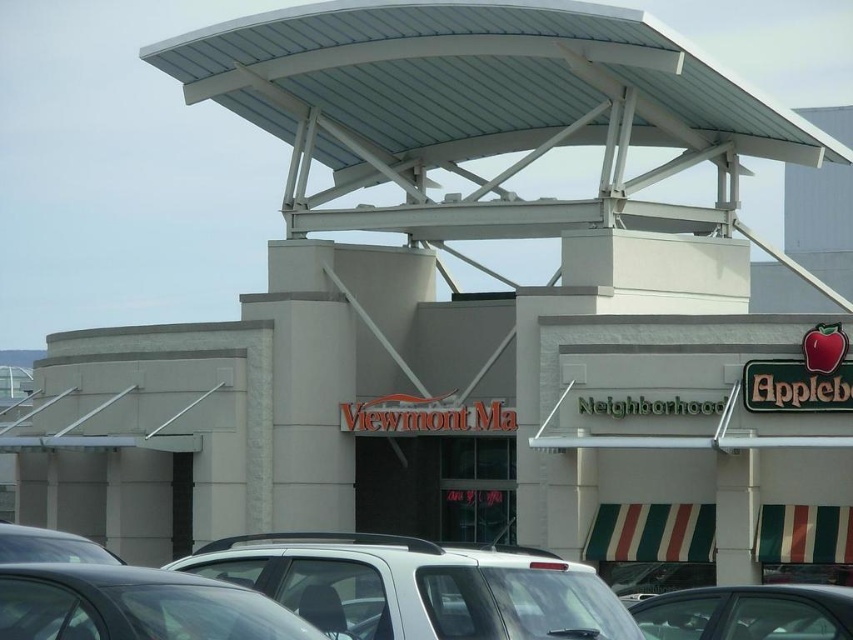
Question: Is white matte suv at center to the left of metallic silver car at center from the viewer's perspective?

Choices:
 (A) no
 (B) yes

Answer: (B)

Question: Based on their relative distances, which object is farther from the white matte suv at center?

Choices:
 (A) shiny black car at lower left
 (B) metallic silver car at center

Answer: (B)

Question: Is shiny black car at lower left to the right of metallic silver car at center from the viewer's perspective?

Choices:
 (A) no
 (B) yes

Answer: (A)

Question: Which of the following is the closest to the observer?

Choices:
 (A) (637, 621)
 (B) (590, 580)

Answer: (B)

Question: Is shiny black car at lower left positioned before metallic silver car at center?

Choices:
 (A) yes
 (B) no

Answer: (A)

Question: Among these points, which one is farthest from the camera?

Choices:
 (A) (347, 625)
 (B) (311, 636)

Answer: (A)